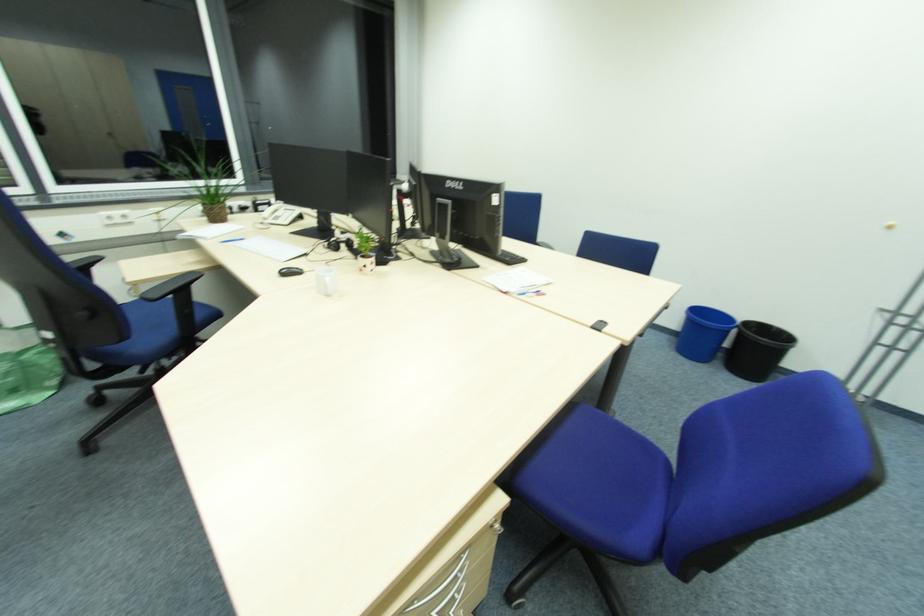
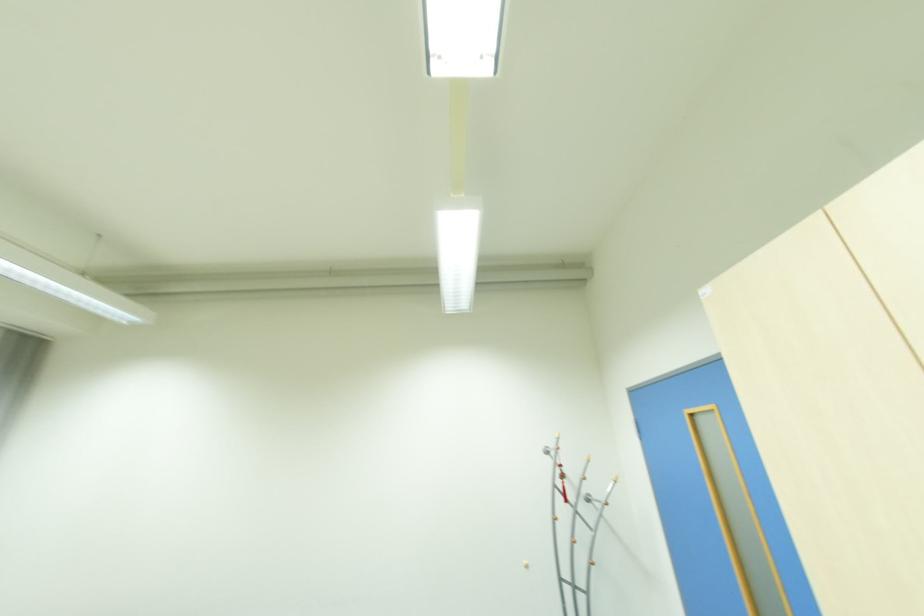
In the scene shown: First-person continuous shooting, in which direction is the camera rotating?

The rotation direction of the camera is right-up.